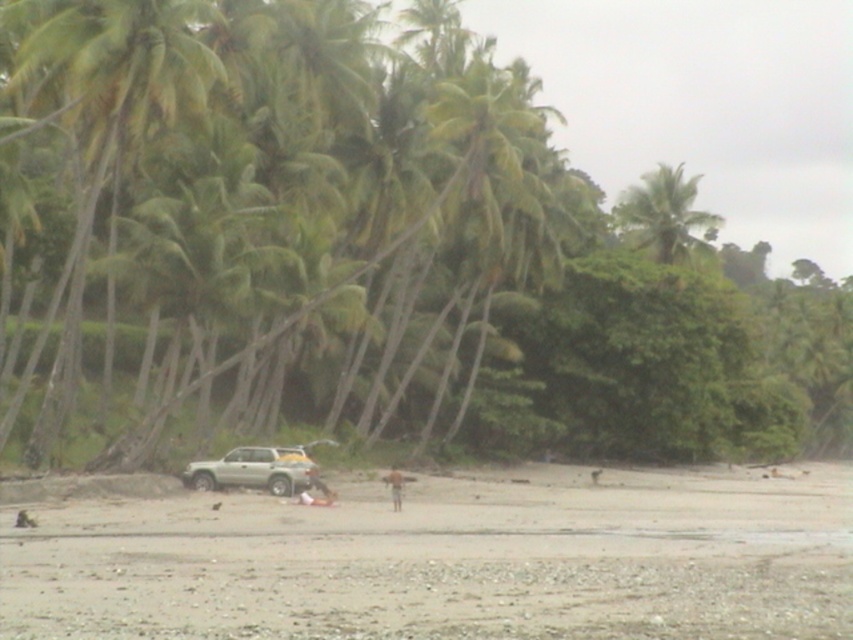
Question: Can you confirm if metallic silver car at center is positioned to the right of green leafy palm tree at left?

Choices:
 (A) no
 (B) yes

Answer: (B)

Question: Is green leafy palm tree at upper right closer to camera compared to light brown skin at center?

Choices:
 (A) no
 (B) yes

Answer: (A)

Question: Which point appears farthest from the camera in this image?

Choices:
 (A) (680, 237)
 (B) (167, 365)
 (C) (132, 579)
 (D) (393, 506)

Answer: (A)

Question: Which object appears farthest from the camera in this image?

Choices:
 (A) smooth beige sand at center
 (B) green leafy palm tree at left

Answer: (B)

Question: Does metallic silver car at center appear on the right side of silver metallic jeep at lower center?

Choices:
 (A) yes
 (B) no

Answer: (A)

Question: Which of these objects is positioned farthest from the green leafy palm tree at upper right?

Choices:
 (A) green leafy palm tree at left
 (B) smooth beige sand at center

Answer: (A)